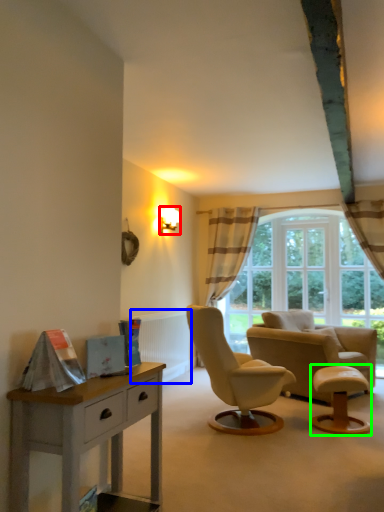
Question: Considering the real-world distances, which object is farthest from lamp (highlighted by a red box)? radiator (highlighted by a blue box) or stool (highlighted by a green box)?

Choices:
 (A) radiator
 (B) stool

Answer: (B)